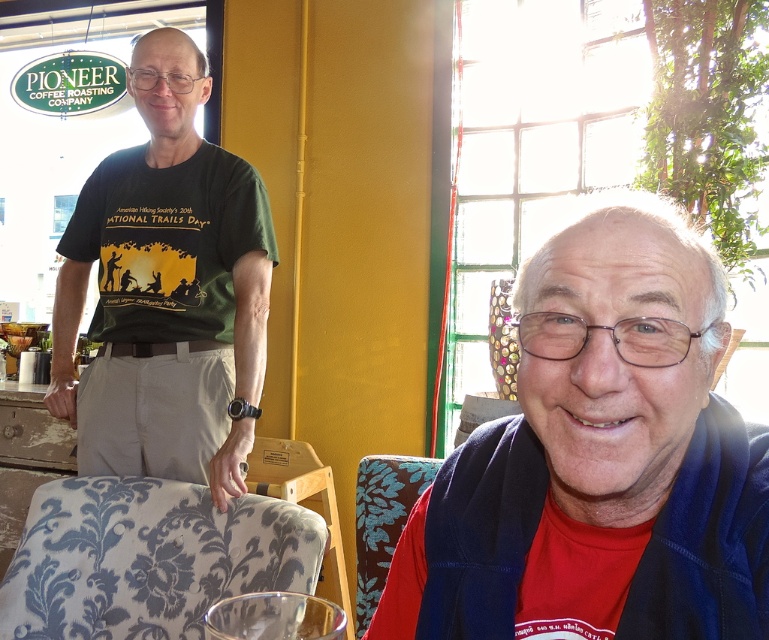
Question: Which point is closer to the camera taking this photo?

Choices:
 (A) (251, 273)
 (B) (747, 436)

Answer: (B)

Question: Among these objects, which one is farthest from the camera?

Choices:
 (A) red matte vest at center
 (B) green matte t-shirt at center

Answer: (B)

Question: Which of the following is the closest to the observer?

Choices:
 (A) (247, 243)
 (B) (561, 488)

Answer: (B)

Question: In this image, where is red matte vest at center located relative to green matte t-shirt at center?

Choices:
 (A) right
 (B) left

Answer: (A)

Question: Does red matte vest at center appear on the right side of green matte t-shirt at center?

Choices:
 (A) yes
 (B) no

Answer: (A)

Question: Is red matte vest at center below green matte t-shirt at center?

Choices:
 (A) yes
 (B) no

Answer: (A)